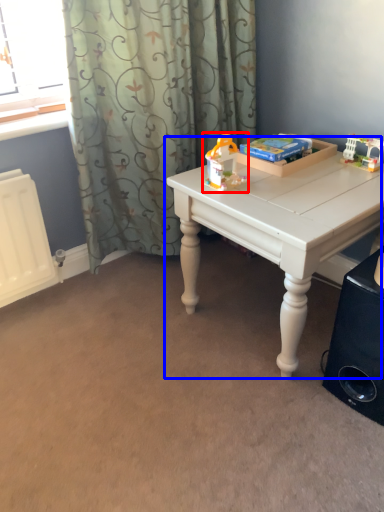
Question: Which of the following is the closest to the observer, toy (highlighted by a red box) or table (highlighted by a blue box)?

Choices:
 (A) toy
 (B) table

Answer: (B)